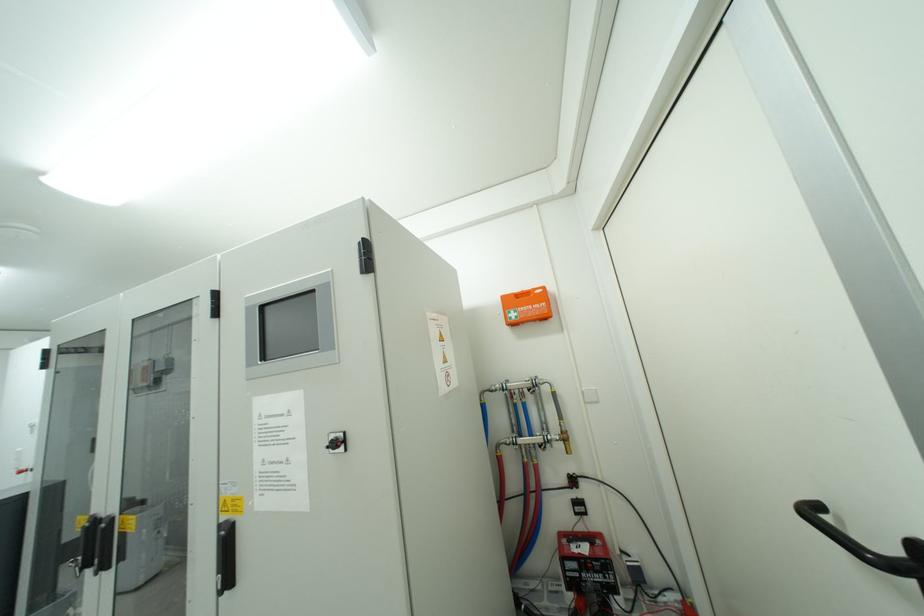
Find the location of `black rotary switch`. black rotary switch is located at coordinates (335, 443).